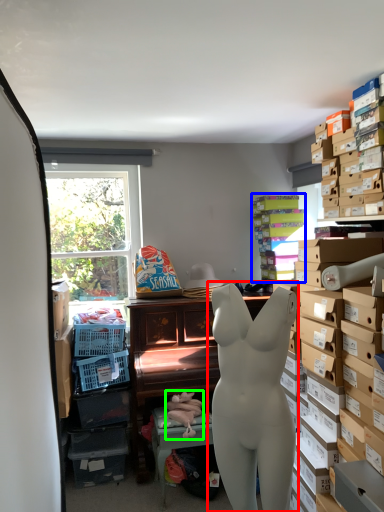
Question: Which object is positioned farthest from person (highlighted by a red box)? Select from shelf (highlighted by a blue box) and toy (highlighted by a green box).

Choices:
 (A) shelf
 (B) toy

Answer: (A)